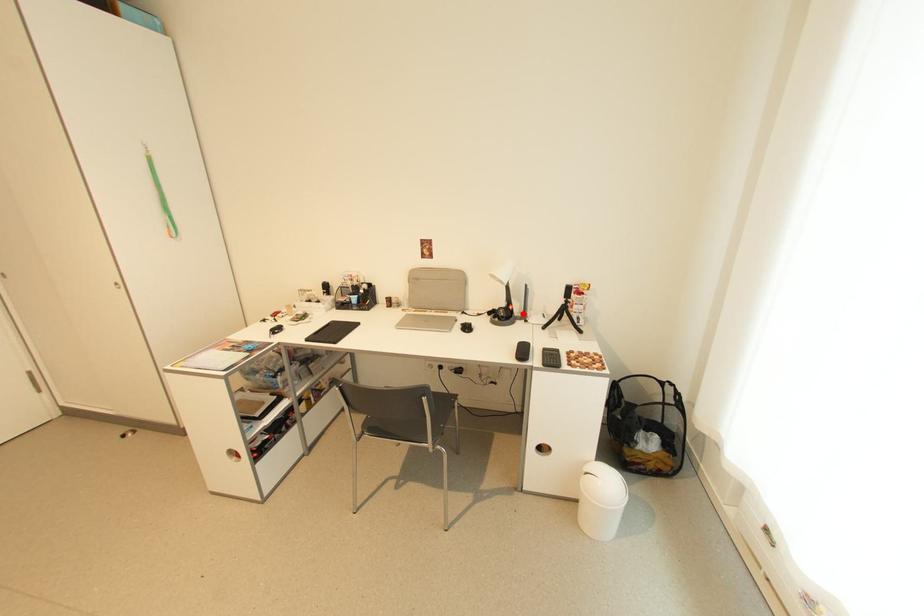
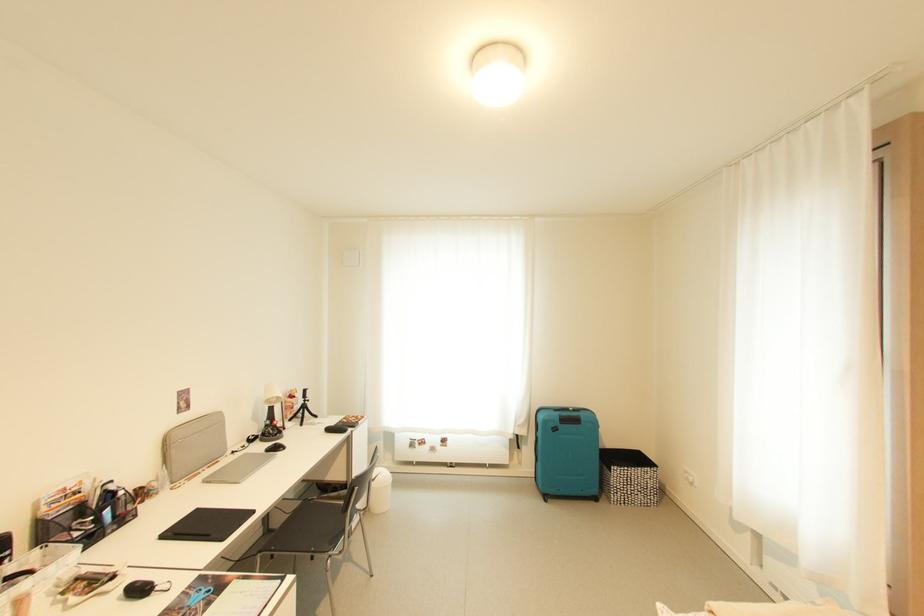
Find the pixel in the second image that matches the highlighted location in the first image.

(262, 434)